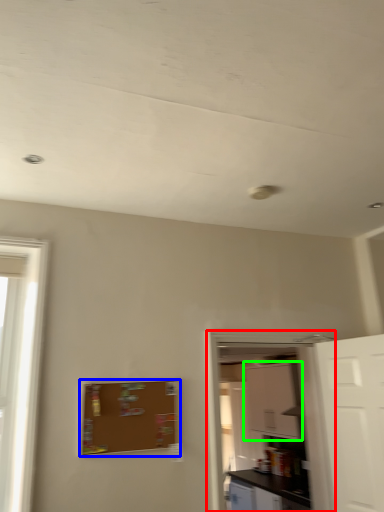
Question: Which is nearer to the screen door (highlighted by a red box)? bulletin board (highlighted by a blue box) or cabinetry (highlighted by a green box).

Choices:
 (A) bulletin board
 (B) cabinetry

Answer: (A)